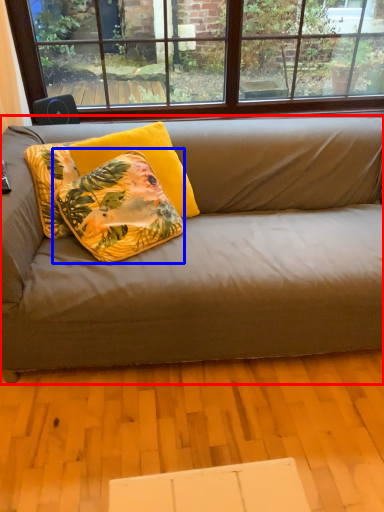
Question: Which of the following is the farthest to the observer, studio couch (highlighted by a red box) or pillow (highlighted by a blue box)?

Choices:
 (A) studio couch
 (B) pillow

Answer: (B)